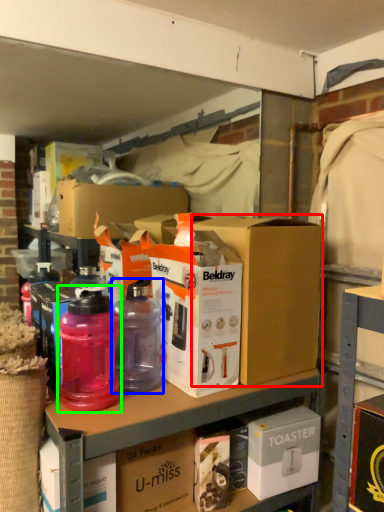
Question: Based on their relative distances, which object is nearer to box (highlighted by a red box)? Choose from bottle (highlighted by a blue box) and bottle (highlighted by a green box).

Choices:
 (A) bottle
 (B) bottle

Answer: (A)